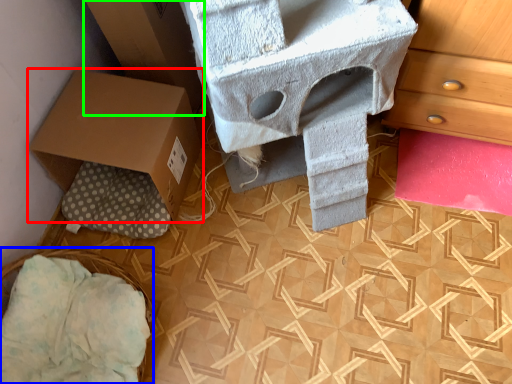
Question: Considering the real-world distances, which object is farthest from box (highlighted by a red box)? basket (highlighted by a blue box) or cardboard box (highlighted by a green box)?

Choices:
 (A) basket
 (B) cardboard box

Answer: (A)